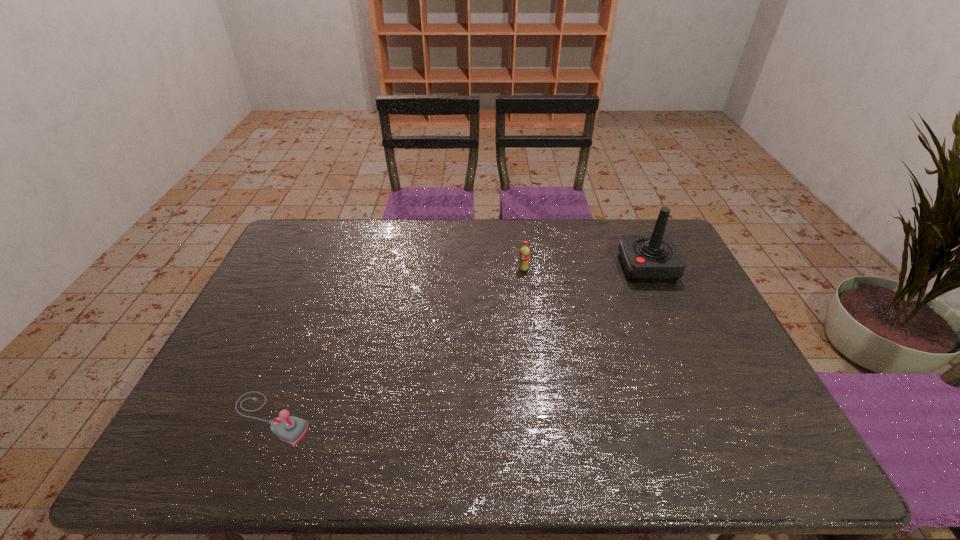
Locate an element on the screen. empty space that is in between the farther joystick and the second shortest object is located at coordinates (586, 268).

This screenshot has width=960, height=540. In order to click on free space between the second tallest object and the nearest object in this screenshot , I will do `click(397, 343)`.

The width and height of the screenshot is (960, 540). Identify the location of unoccupied area between the shortest object and the soda. pos(397,343).

Image resolution: width=960 pixels, height=540 pixels. What are the coordinates of `object that is the closest one to the rightmost object` in the screenshot? It's located at (524, 255).

Point out which object is positioned as the nearest to the second object from left to right. Please provide its 2D coordinates. Your answer should be formatted as a tuple, i.e. [(x, y)], where the tuple contains the x and y coordinates of a point satisfying the conditions above.

[(646, 258)]

At what (x,y) coordinates should I click in order to perform the action: click on vacant space that satisfies the following two spatial constraints: 1. on the back side of the second tallest object; 2. on the right side of the left joystick. Please return your answer as a coordinate pair (x, y). This screenshot has height=540, width=960. Looking at the image, I should click on (330, 269).

I want to click on free space that satisfies the following two spatial constraints: 1. on the front-facing side of the tallest object; 2. on the front side of the left joystick, so click(713, 418).